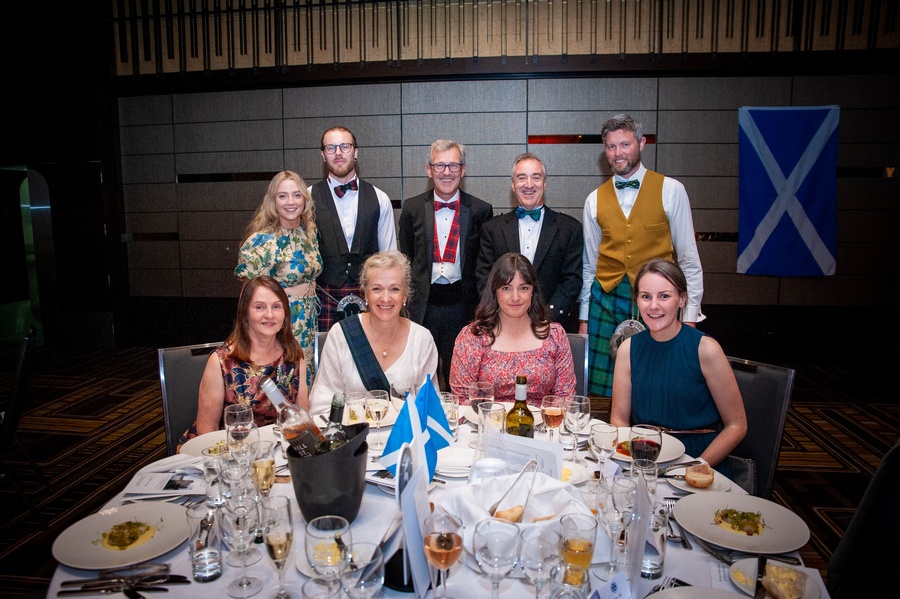
Locate an element on the screen. The width and height of the screenshot is (900, 599). right chair is located at coordinates (772, 414).